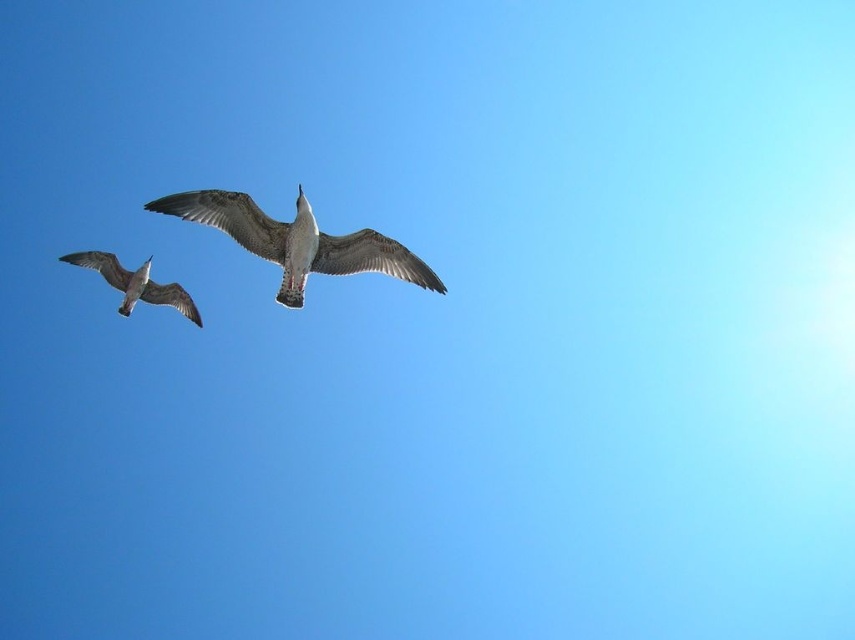
Between white feathered bird at center and white feathered bird at left, which one is positioned higher?

white feathered bird at center is higher up.

Does white feathered bird at center appear on the left side of white feathered bird at left?

Incorrect, white feathered bird at center is not on the left side of white feathered bird at left.

This screenshot has width=855, height=640. Describe the element at coordinates (296, 241) in the screenshot. I see `white feathered bird at center` at that location.

Identify the location of white feathered bird at center. The height and width of the screenshot is (640, 855). (296, 241).